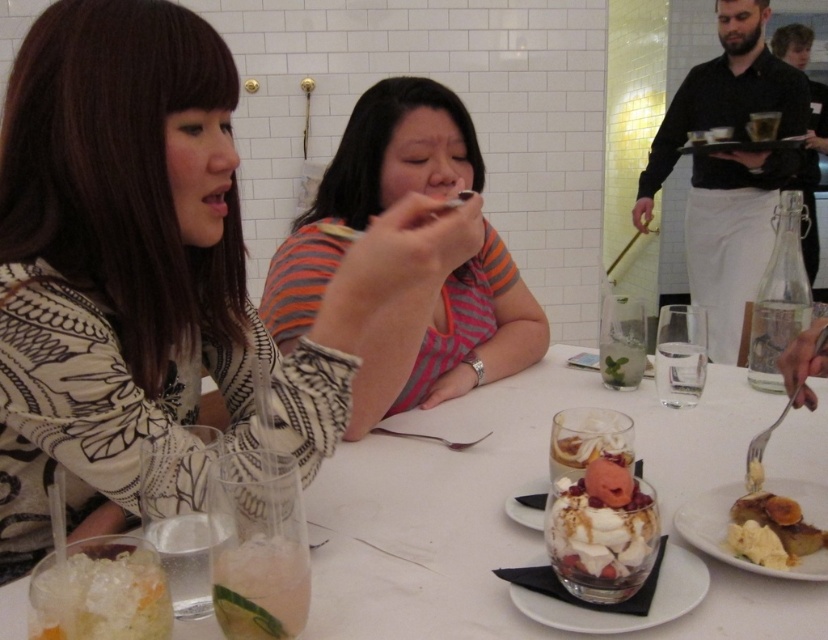
Who is shorter, patterned fabric shirt at upper left or clear glass dessert at center?

clear glass dessert at center

Which is in front, point (176, 403) or point (532, 600)?

Positioned in front is point (532, 600).

At what (x,y) coordinates should I click in order to perform the action: click on patterned fabric shirt at upper left. Please return your answer as a coordinate pair (x, y). The height and width of the screenshot is (640, 828). Looking at the image, I should click on (148, 266).

Does patterned fabric shirt at upper left appear under white porcelain plate at center?

Incorrect, patterned fabric shirt at upper left is not positioned below white porcelain plate at center.

Which is above, patterned fabric shirt at upper left or white porcelain plate at center?

patterned fabric shirt at upper left is above.

What do you see at coordinates (148, 266) in the screenshot? I see `patterned fabric shirt at upper left` at bounding box center [148, 266].

Find the location of a particular element. patterned fabric shirt at upper left is located at coordinates (148, 266).

Is white porcelain table at center thinner than clear gelatinous dessert at lower left?

Incorrect, white porcelain table at center's width is not less than clear gelatinous dessert at lower left's.

Does white porcelain table at center have a lesser height compared to clear gelatinous dessert at lower left?

No.

Locate an element on the screen. white porcelain table at center is located at coordinates 490,499.

Where is `white porcelain table at center`? white porcelain table at center is located at coordinates (490, 499).